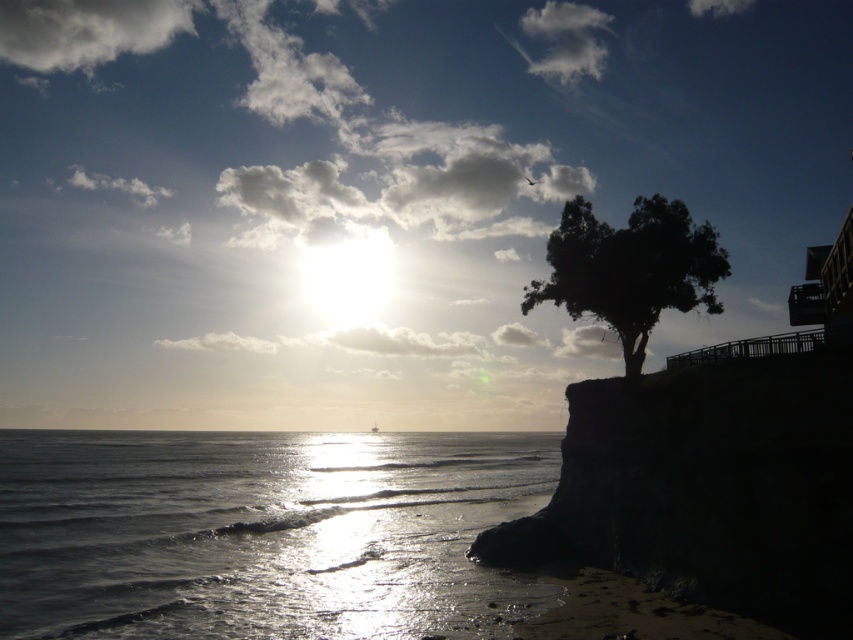
You are standing at the center of the image and want to walk towards the dark green leafy tree at upper right. Which direction should you face to ensure you are moving towards it without obstacles from the glistening silver water at lower left?

You should face towards the upper right direction to move towards the dark green leafy tree at upper right. Since the glistening silver water at lower left is to the left of the tree, facing upper right will keep the water on your left side, avoiding obstacles in your path.

You are a photographer trying to capture the sunset scene. You want to ensure that both the glistening silver water at lower left and the dark green leafy tree at upper right are visible in your photo. Based on their sizes in the image, which object will occupy more of the frame?

The glistening silver water at lower left is bigger than the dark green leafy tree at upper right, so it will occupy more of the frame.